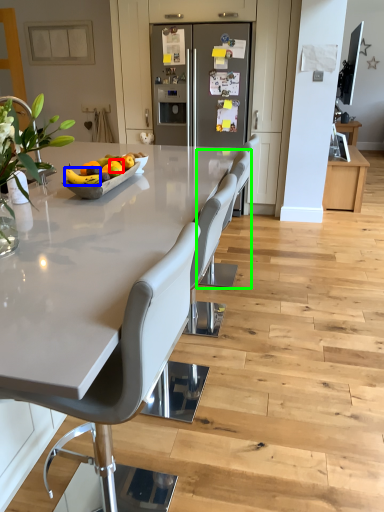
Question: Which object is positioned farthest from orange (highlighted by a red box)? Select from fruit (highlighted by a blue box) and chair (highlighted by a green box).

Choices:
 (A) fruit
 (B) chair

Answer: (B)